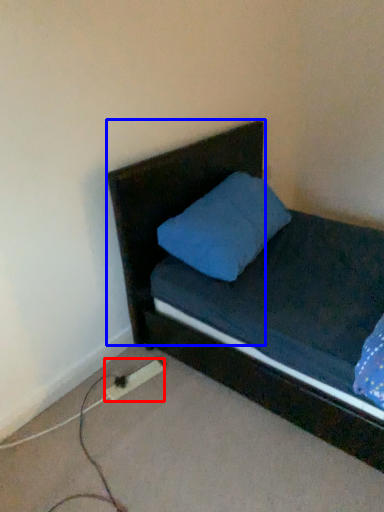
Question: Which object appears closest to the camera in this image, extension cord (highlighted by a red box) or headboard (highlighted by a blue box)?

Choices:
 (A) extension cord
 (B) headboard

Answer: (B)